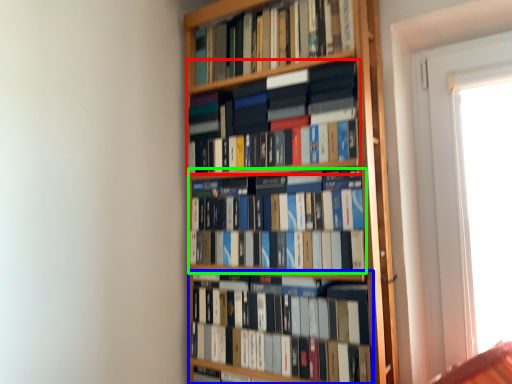
Question: Considering the real-world distances, which object is farthest from book (highlighted by a red box)? book (highlighted by a blue box) or book (highlighted by a green box)?

Choices:
 (A) book
 (B) book

Answer: (A)